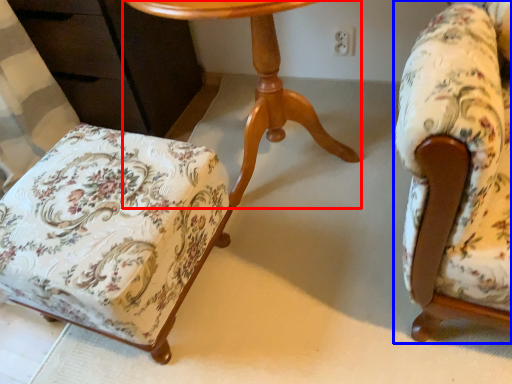
Question: Which point is further to the camera, table (highlighted by a red box) or chair (highlighted by a blue box)?

Choices:
 (A) table
 (B) chair

Answer: (A)